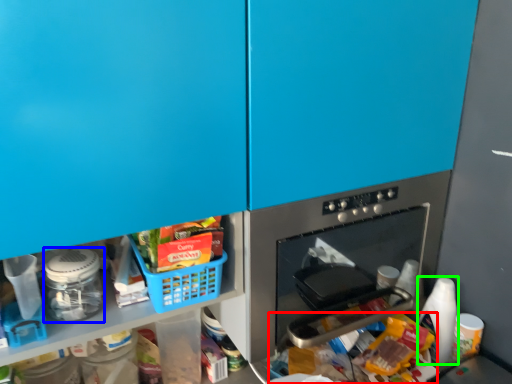
Question: Based on their relative distances, which object is farther from food (highlighted by a red box)? Choose from appliance (highlighted by a blue box) and bottle (highlighted by a green box).

Choices:
 (A) appliance
 (B) bottle

Answer: (A)